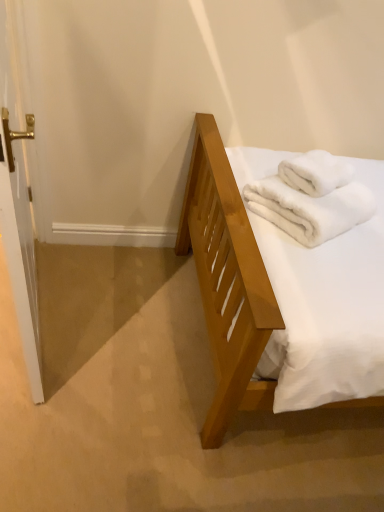
Question: Can we say white fluffy bath towel at upper right, positioned as the 1th bath towel in top-to-bottom order, lies outside white fluffy bath towel at upper right, arranged as the first bath towel when ordered from the bottom?

Choices:
 (A) no
 (B) yes

Answer: (A)

Question: Is white fluffy bath towel at upper right, placed as the second bath towel when sorted from bottom to top, facing towards white fluffy bath towel at upper right, arranged as the first bath towel when ordered from the bottom?

Choices:
 (A) yes
 (B) no

Answer: (A)

Question: From a real-world perspective, is white fluffy bath towel at upper right, placed as the second bath towel when sorted from bottom to top, on white fluffy bath towel at upper right, the second bath towel viewed from the top?

Choices:
 (A) yes
 (B) no

Answer: (A)

Question: Considering the relative positions of white fluffy bath towel at upper right, positioned as the 1th bath towel in top-to-bottom order, and white fluffy bath towel at upper right, arranged as the first bath towel when ordered from the bottom, in the image provided, is white fluffy bath towel at upper right, positioned as the 1th bath towel in top-to-bottom order, to the left of white fluffy bath towel at upper right, arranged as the first bath towel when ordered from the bottom, from the viewer's perspective?

Choices:
 (A) no
 (B) yes

Answer: (A)

Question: Is white fluffy bath towel at upper right, positioned as the 1th bath towel in top-to-bottom order, not close to white fluffy bath towel at upper right, the second bath towel viewed from the top?

Choices:
 (A) yes
 (B) no

Answer: (B)

Question: From the image's perspective, would you say white fluffy bath towel at upper right, placed as the second bath towel when sorted from bottom to top, is shown under white fluffy bath towel at upper right, the second bath towel viewed from the top?

Choices:
 (A) no
 (B) yes

Answer: (A)

Question: Considering the relative positions of white fluffy bath towel at upper right, the second bath towel viewed from the top, and white fluffy bath towel at upper right, positioned as the 1th bath towel in top-to-bottom order, in the image provided, is white fluffy bath towel at upper right, the second bath towel viewed from the top, to the right of white fluffy bath towel at upper right, positioned as the 1th bath towel in top-to-bottom order, from the viewer's perspective?

Choices:
 (A) yes
 (B) no

Answer: (B)

Question: Considering the relative sizes of white fluffy bath towel at upper right, the second bath towel viewed from the top, and white fluffy bath towel at upper right, placed as the second bath towel when sorted from bottom to top, in the image provided, is white fluffy bath towel at upper right, the second bath towel viewed from the top, taller than white fluffy bath towel at upper right, placed as the second bath towel when sorted from bottom to top,?

Choices:
 (A) yes
 (B) no

Answer: (A)

Question: Is white fluffy bath towel at upper right, arranged as the first bath towel when ordered from the bottom, wider than white fluffy bath towel at upper right, placed as the second bath towel when sorted from bottom to top?

Choices:
 (A) yes
 (B) no

Answer: (A)

Question: Is white fluffy bath towel at upper right, arranged as the first bath towel when ordered from the bottom, at the left side of white fluffy bath towel at upper right, positioned as the 1th bath towel in top-to-bottom order?

Choices:
 (A) yes
 (B) no

Answer: (A)

Question: Is white fluffy bath towel at upper right, the second bath towel viewed from the top, not near white fluffy bath towel at upper right, positioned as the 1th bath towel in top-to-bottom order?

Choices:
 (A) yes
 (B) no

Answer: (B)

Question: Is white fluffy bath towel at upper right, arranged as the first bath towel when ordered from the bottom, positioned beyond the bounds of white fluffy bath towel at upper right, placed as the second bath towel when sorted from bottom to top?

Choices:
 (A) yes
 (B) no

Answer: (A)

Question: Is white glossy door handle at left not inside white fluffy bath towel at upper right, the second bath towel viewed from the top?

Choices:
 (A) yes
 (B) no

Answer: (A)